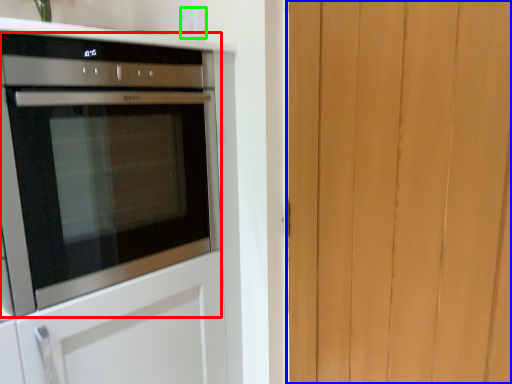
Question: Estimate the real-world distances between objects in this image. Which object is closer to oven (highlighted by a red box), barn door (highlighted by a blue box) or electric outlet (highlighted by a green box)?

Choices:
 (A) barn door
 (B) electric outlet

Answer: (B)